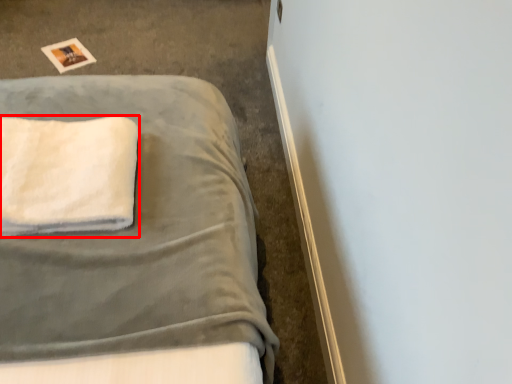
Question: In this image, where is towel (annotated by the red box) located relative to bed?

Choices:
 (A) right
 (B) left

Answer: (A)